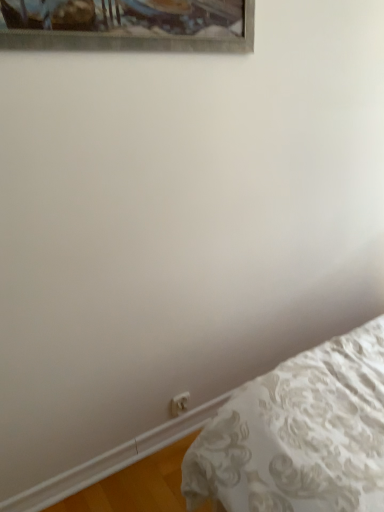
Question: From the image's perspective, does white plastic electric outlet at lower center appear lower than white textured bed at lower right?

Choices:
 (A) no
 (B) yes

Answer: (A)

Question: Considering the relative sizes of white plastic electric outlet at lower center and white textured bed at lower right in the image provided, is white plastic electric outlet at lower center smaller than white textured bed at lower right?

Choices:
 (A) yes
 (B) no

Answer: (A)

Question: Is white plastic electric outlet at lower center placed right next to white textured bed at lower right?

Choices:
 (A) no
 (B) yes

Answer: (A)

Question: From a real-world perspective, is white plastic electric outlet at lower center on top of white textured bed at lower right?

Choices:
 (A) yes
 (B) no

Answer: (A)

Question: Does white plastic electric outlet at lower center come behind white textured bed at lower right?

Choices:
 (A) no
 (B) yes

Answer: (B)

Question: From the image's perspective, is white plastic electric outlet at lower center on top of white textured bed at lower right?

Choices:
 (A) no
 (B) yes

Answer: (B)

Question: Considering the relative positions of white textured bed at lower right and white plastic electric outlet at lower center in the image provided, is white textured bed at lower right to the left of white plastic electric outlet at lower center from the viewer's perspective?

Choices:
 (A) yes
 (B) no

Answer: (B)

Question: Does white textured bed at lower right have a smaller size compared to white plastic electric outlet at lower center?

Choices:
 (A) no
 (B) yes

Answer: (A)

Question: Is white textured bed at lower right further to camera compared to white plastic electric outlet at lower center?

Choices:
 (A) no
 (B) yes

Answer: (A)

Question: Does white textured bed at lower right appear on the right side of white plastic electric outlet at lower center?

Choices:
 (A) yes
 (B) no

Answer: (A)

Question: Can you confirm if white textured bed at lower right is taller than white plastic electric outlet at lower center?

Choices:
 (A) yes
 (B) no

Answer: (B)

Question: Is white textured bed at lower right turned away from white plastic electric outlet at lower center?

Choices:
 (A) yes
 (B) no

Answer: (B)

Question: From the image's perspective, is white plastic electric outlet at lower center above or below white textured bed at lower right?

Choices:
 (A) above
 (B) below

Answer: (A)